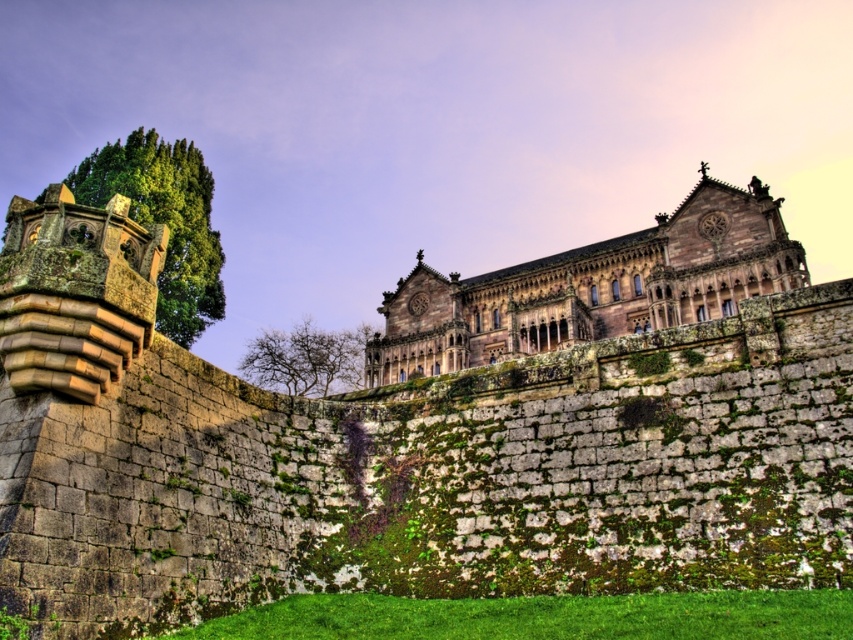
You are an architect assessing the symmetry of the historic building. The green leafy tree at left and the bare branches at center are part of the scene. Which object has a greater width?

The green leafy tree at left has a greater width than the bare branches at center, as stated in the description that its width surpasses the latter.

You are standing in front of the historic building and want to reach the point marked at coordinates point (415, 308). Can you estimate how far you need to walk to get there?

The distance between you and the point (415, 308) is 406.73 feet, so you need to walk approximately 406.73 feet to reach it.

From the picture: You are standing in front of the historic building and want to take a photo that includes both the brown stone palace at center and the crenellated parapet of the stone wall in the foreground. Based on their positions, will the palace be positioned to the left or right of the parapet in the frame?

The brown stone palace at center is located at point (590, 288), so in the frame, the palace will be positioned to the right of the crenellated parapet of the stone wall in the foreground.